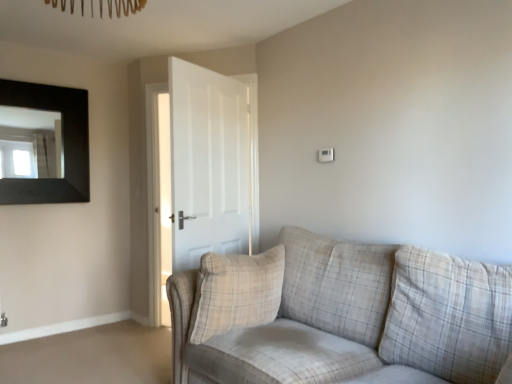
Question: Considering the relative sizes of white matte door at center and black matte picture frame at upper left in the image provided, is white matte door at center shorter than black matte picture frame at upper left?

Choices:
 (A) yes
 (B) no

Answer: (B)

Question: Considering the relative sizes of white matte door at center and black matte picture frame at upper left in the image provided, is white matte door at center thinner than black matte picture frame at upper left?

Choices:
 (A) no
 (B) yes

Answer: (A)

Question: Is white matte door at center not inside black matte picture frame at upper left?

Choices:
 (A) yes
 (B) no

Answer: (A)

Question: Is white matte door at center positioned before black matte picture frame at upper left?

Choices:
 (A) no
 (B) yes

Answer: (B)

Question: Is white matte door at center facing towards black matte picture frame at upper left?

Choices:
 (A) yes
 (B) no

Answer: (A)

Question: Would you say beige plaid pillow at center is to the left or to the right of white matte door at center in the picture?

Choices:
 (A) left
 (B) right

Answer: (B)

Question: From the image's perspective, is beige plaid pillow at center positioned above or below white matte door at center?

Choices:
 (A) below
 (B) above

Answer: (A)

Question: Considering the positions of point (256, 286) and point (138, 314), is point (256, 286) closer or farther from the camera than point (138, 314)?

Choices:
 (A) farther
 (B) closer

Answer: (B)

Question: From their relative heights in the image, would you say beige plaid pillow at center is taller or shorter than white matte door at center?

Choices:
 (A) tall
 (B) short

Answer: (B)

Question: In the image, is black matte picture frame at upper left positioned in front of or behind beige plaid pillow at center?

Choices:
 (A) front
 (B) behind

Answer: (B)

Question: In terms of height, does black matte picture frame at upper left look taller or shorter compared to beige plaid pillow at center?

Choices:
 (A) short
 (B) tall

Answer: (B)

Question: Is black matte picture frame at upper left situated inside beige plaid pillow at center or outside?

Choices:
 (A) outside
 (B) inside

Answer: (A)

Question: From the image's perspective, relative to beige plaid pillow at center, is black matte picture frame at upper left above or below?

Choices:
 (A) below
 (B) above

Answer: (B)

Question: Would you say white matte door at center is to the left or to the right of beige plaid pillow at center in the picture?

Choices:
 (A) left
 (B) right

Answer: (A)

Question: From their relative heights in the image, would you say white matte door at center is taller or shorter than beige plaid pillow at center?

Choices:
 (A) tall
 (B) short

Answer: (A)